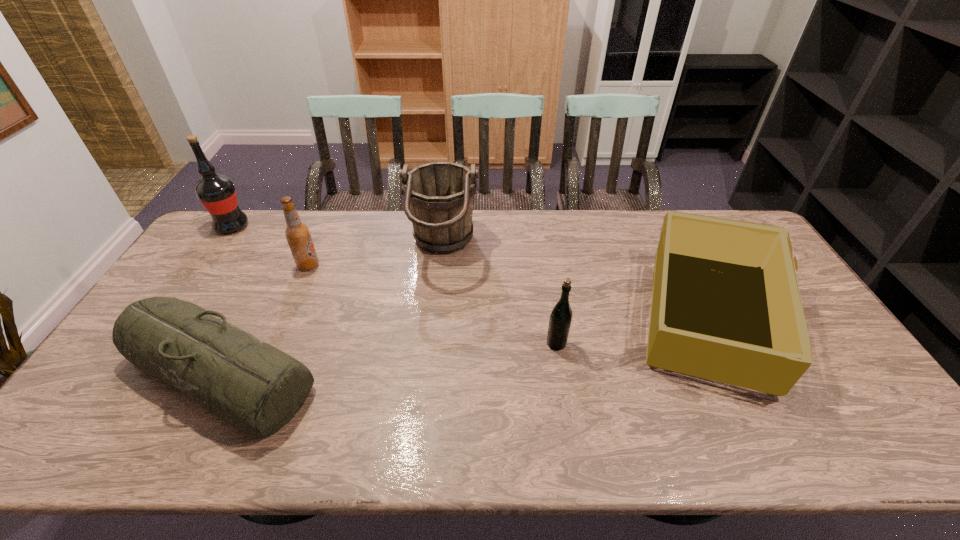
This screenshot has height=540, width=960. I want to click on free spot located 0.090m on the front label of the left beer bottle, so click(348, 266).

In order to click on blank space located 0.140m on the front of the nearer beer bottle in this screenshot , I will do `click(565, 397)`.

At what (x,y) coordinates should I click in order to perform the action: click on vacant point located on the front of the fifth tallest object. Please return your answer as a coordinate pair (x, y). This screenshot has width=960, height=540. Looking at the image, I should click on (759, 426).

I want to click on vacant space situated on the right of the duffel bag, so click(345, 374).

I want to click on wine bottle located in the far edge section of the desktop, so click(x=217, y=193).

I want to click on bucket situated at the far edge, so click(439, 196).

I want to click on object that is at the near edge, so click(x=256, y=388).

Locate an element on the screen. The image size is (960, 540). wine bottle present at the left edge is located at coordinates (217, 193).

Image resolution: width=960 pixels, height=540 pixels. Find the location of `duffel bag positioned at the left edge`. duffel bag positioned at the left edge is located at coordinates (256, 388).

Where is `object at the right edge`? The image size is (960, 540). object at the right edge is located at coordinates (726, 306).